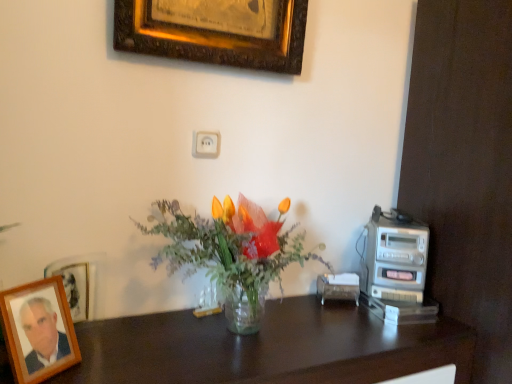
Find the location of a particular element. Image resolution: width=512 pixels, height=384 pixels. vacant region to the left of silver metallic stereo at right is located at coordinates pyautogui.click(x=339, y=312).